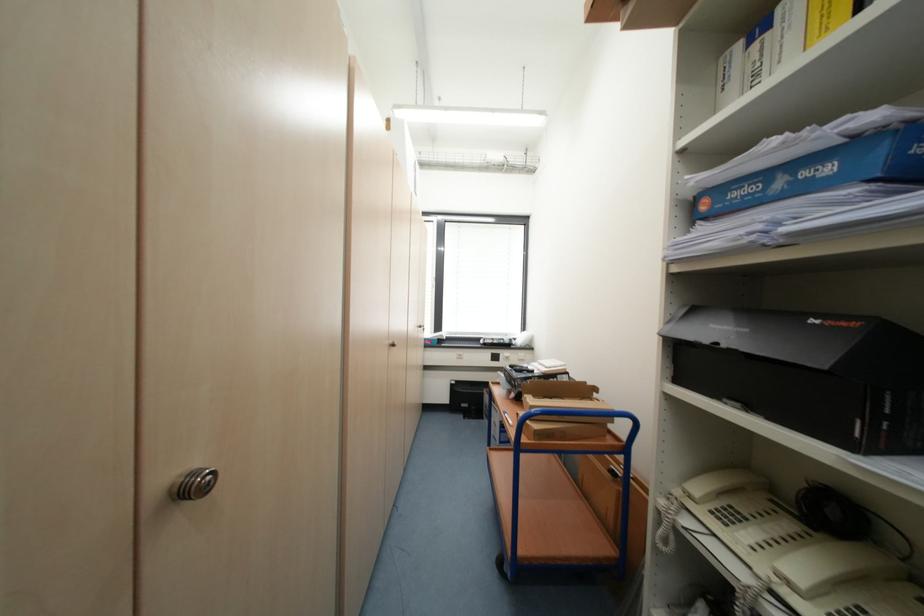
Find where to turn the silver cabinet knob. Please return your answer as a coordinate pair (x, y).

(195, 484)